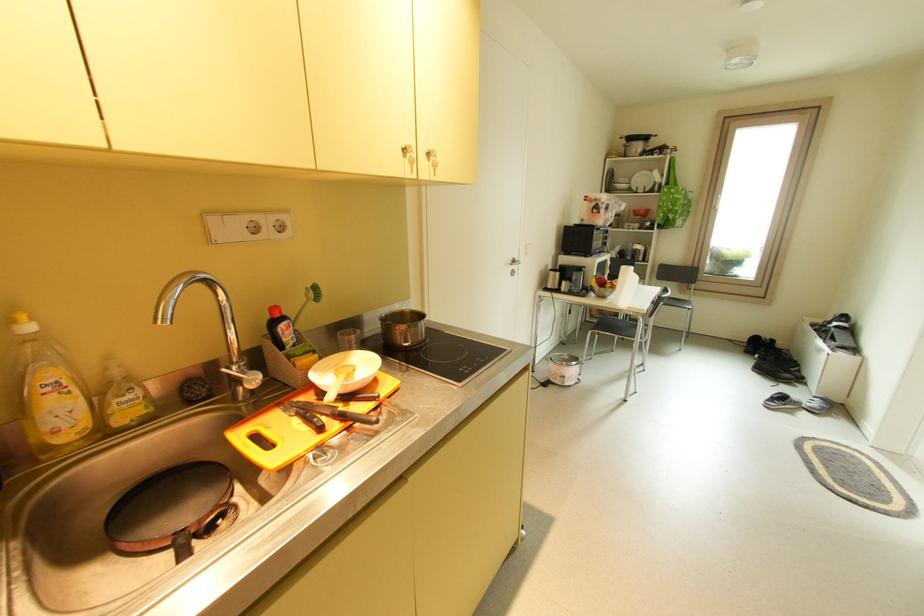
Find where to lift the pink rice cooker. Please return your answer as a coordinate pair (x, y).

(564, 369)